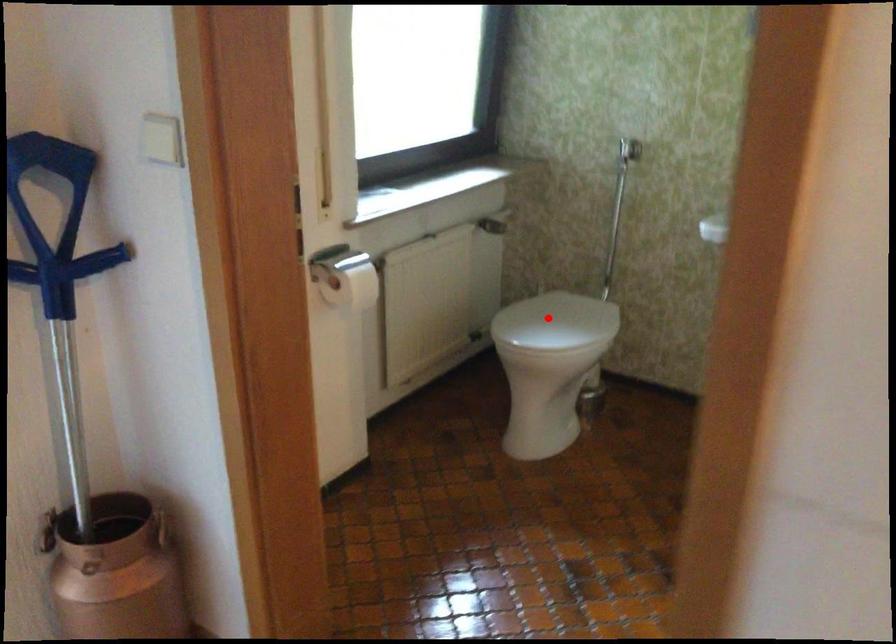
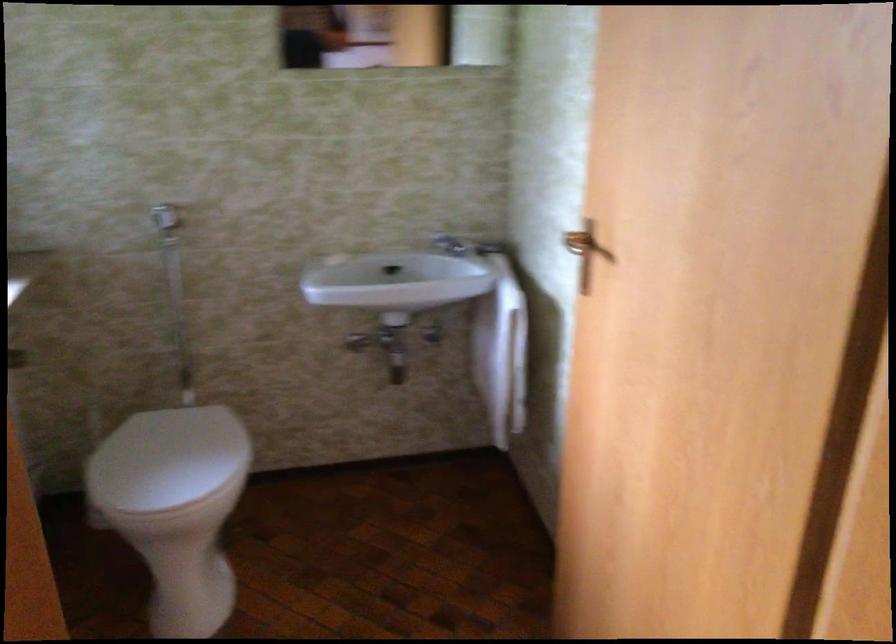
Question: I am providing you with two images of the same scene from different viewpoints. Given a red point in image1, look at the same physical point in image2. Is it:

Choices:
 (A) Closer to the viewpoint
 (B) Farther from the viewpoint

Answer: (A)